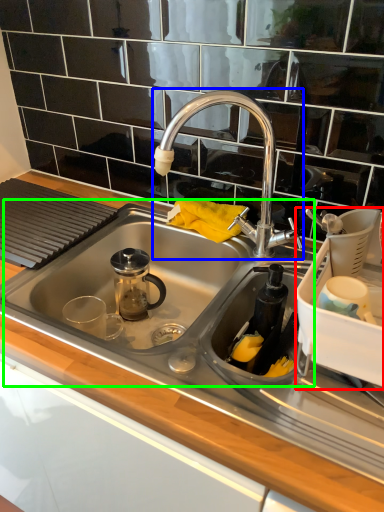
Question: Which object is positioned farthest from appliance (highlighted by a red box)? Select from tap (highlighted by a blue box) and sink (highlighted by a green box).

Choices:
 (A) tap
 (B) sink

Answer: (B)